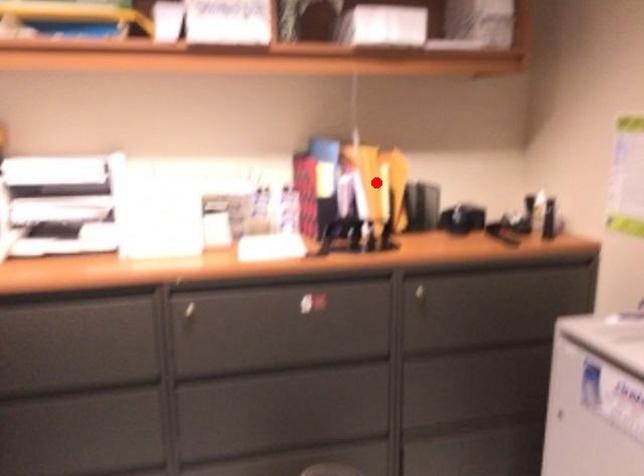
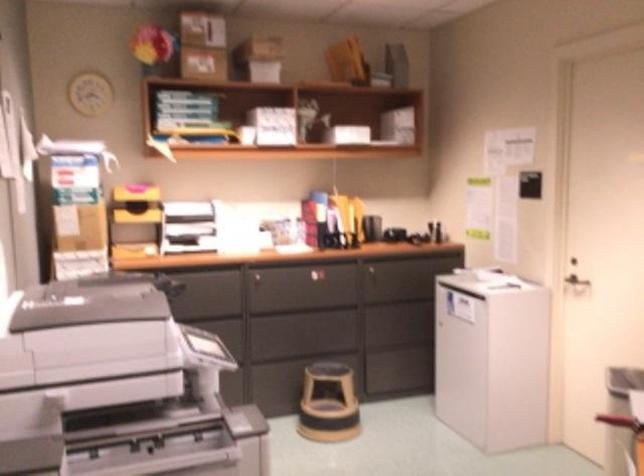
The point at the highlighted location is marked in the first image. Where is the corresponding point in the second image?

(348, 214)